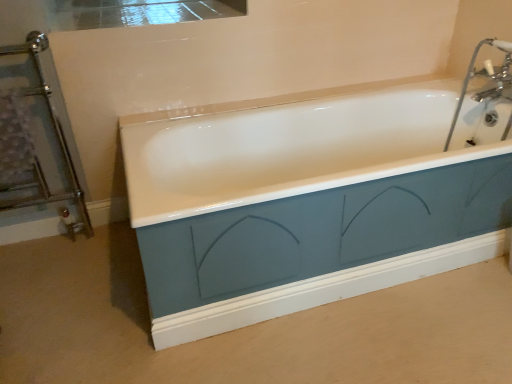
Locate an element on the screen. This screenshot has height=384, width=512. free point below chrome metallic towel rack at left (from a real-world perspective) is located at coordinates (49, 233).